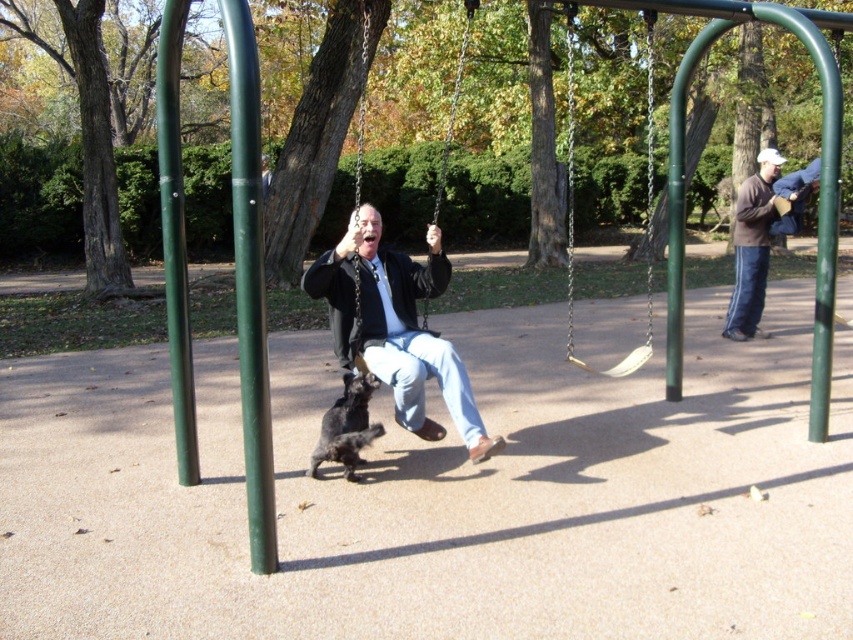
From the picture: You are standing at the center of the playground and want to locate the green metallic pole at left. Which direction should you face to see it?

You should face towards the left direction to see the green metallic pole at left.

You are standing at the point with coordinates point (225, 16) and want to walk to the point with coordinates point (172, 218). Which direction should you move relative to the man on the swing?

You should move behind the man on the swing because point (225, 16) is in front of point (172, 218), so moving towards the latter requires going behind the man.

You are a parent trying to locate your child who is playing in the park. You see the brown sweater at right and the beige fabric swing at center. Which object is closer to you?

The brown sweater at right is closer to you because the beige fabric swing at center is behind it.